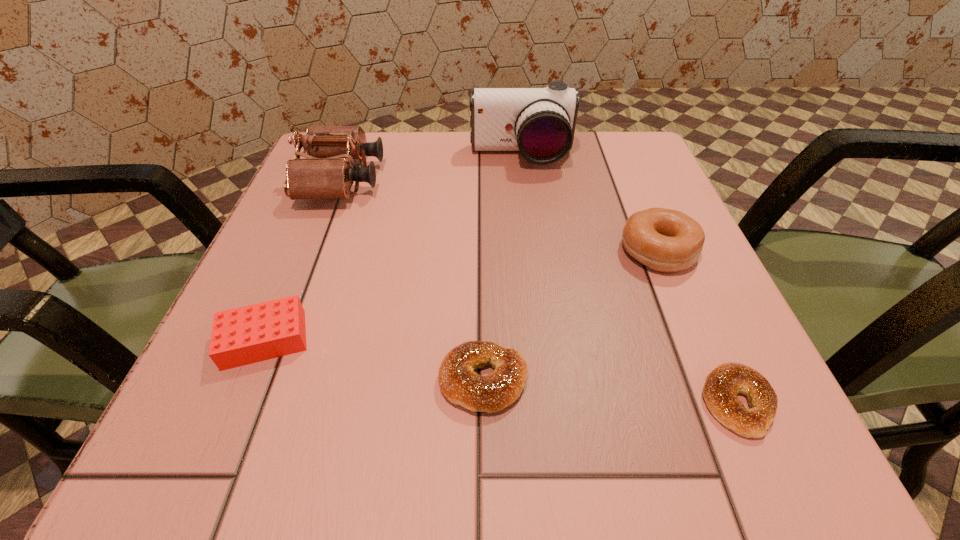
You are a GUI agent. You are given a task and a screenshot of the screen. Output one action in this format:
    pyautogui.click(x=<x>, y=<y>)
    Task: Click on the unoccupied area between the second shortest object and the shortest bagel
    The image size is (960, 540).
    Given the screenshot: What is the action you would take?
    pyautogui.click(x=611, y=392)

Find the location of a particular element. The image size is (960, 540). vacant point located between the second shortest object and the shortest bagel is located at coordinates coord(611,392).

This screenshot has height=540, width=960. What are the coordinates of `unoccupied position between the tallest bagel and the shortest bagel` in the screenshot? It's located at pyautogui.click(x=698, y=327).

Locate an element on the screen. This screenshot has width=960, height=540. free space between the tallest bagel and the shortest object is located at coordinates (698, 327).

Image resolution: width=960 pixels, height=540 pixels. I want to click on free space between the tallest object and the Lego, so click(393, 248).

Identify which object is the second closest to the shortest bagel. Please provide its 2D coordinates. Your answer should be formatted as a tuple, i.e. [(x, y)], where the tuple contains the x and y coordinates of a point satisfying the conditions above.

[(458, 382)]

Locate an element on the screen. The height and width of the screenshot is (540, 960). object that is the third closest one to the Lego is located at coordinates (539, 122).

Locate which bagel is the second closest to the tallest bagel. Please provide its 2D coordinates. Your answer should be formatted as a tuple, i.e. [(x, y)], where the tuple contains the x and y coordinates of a point satisfying the conditions above.

[(458, 382)]

Identify which bagel is the second closest to the second shortest bagel. Please provide its 2D coordinates. Your answer should be formatted as a tuple, i.e. [(x, y)], where the tuple contains the x and y coordinates of a point satisfying the conditions above.

[(664, 240)]

You are a GUI agent. You are given a task and a screenshot of the screen. Output one action in this format:
    pyautogui.click(x=<x>, y=<y>)
    Task: Click on the free spot that satisfies the following two spatial constraints: 1. through the eyepieces of the second tallest bagel; 2. on the left side of the second tallest object
    The width and height of the screenshot is (960, 540).
    Given the screenshot: What is the action you would take?
    pyautogui.click(x=264, y=380)